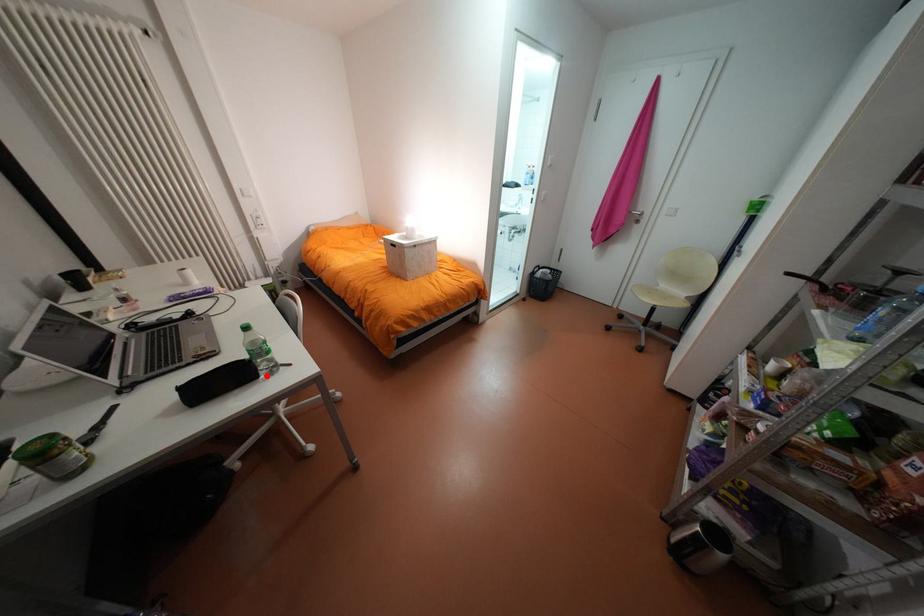
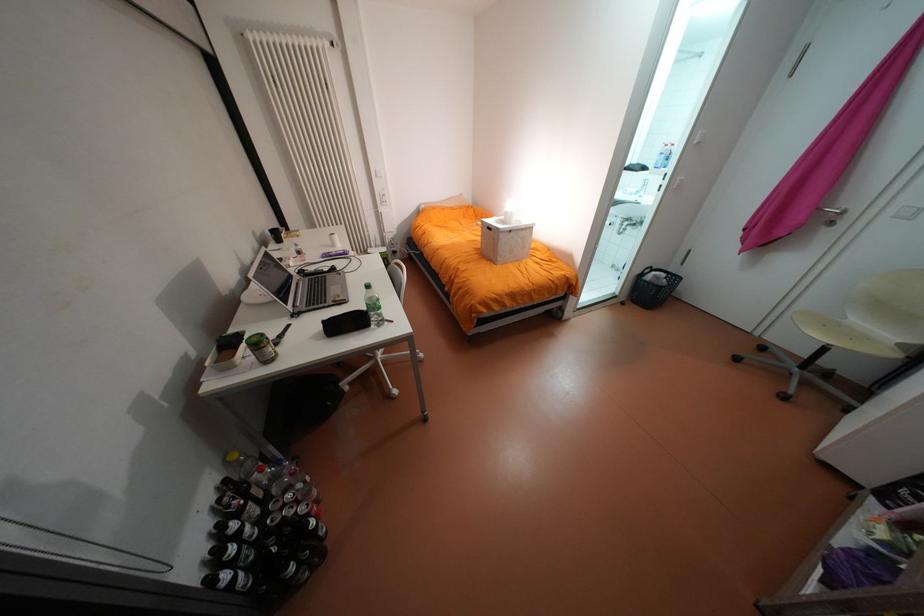
In the second image, find the point that corresponds to the highlighted location in the first image.

(379, 325)